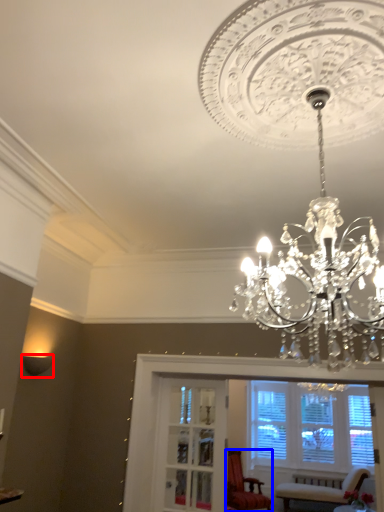
Question: Which of the following is the closest to the observer, lamp (highlighted by a red box) or chair (highlighted by a blue box)?

Choices:
 (A) lamp
 (B) chair

Answer: (A)